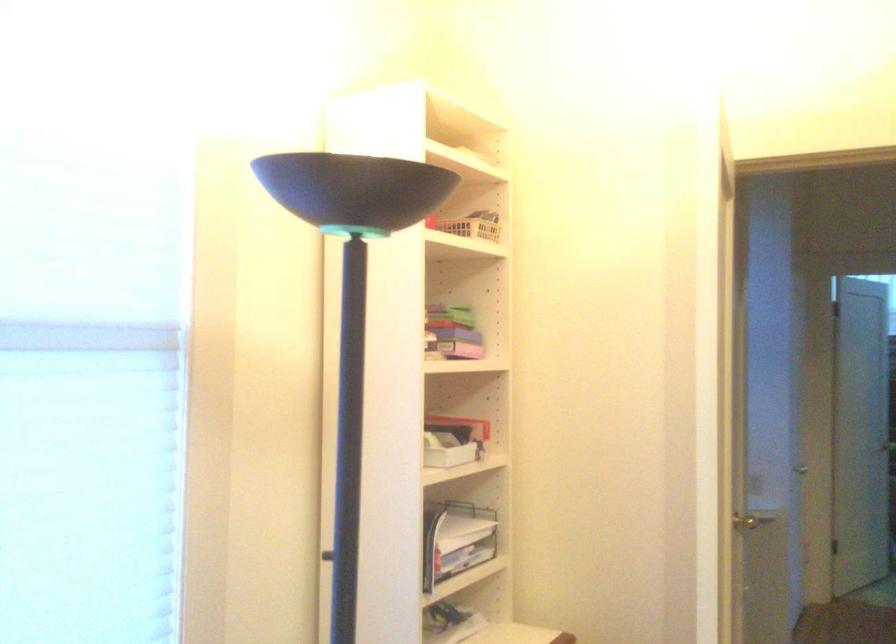
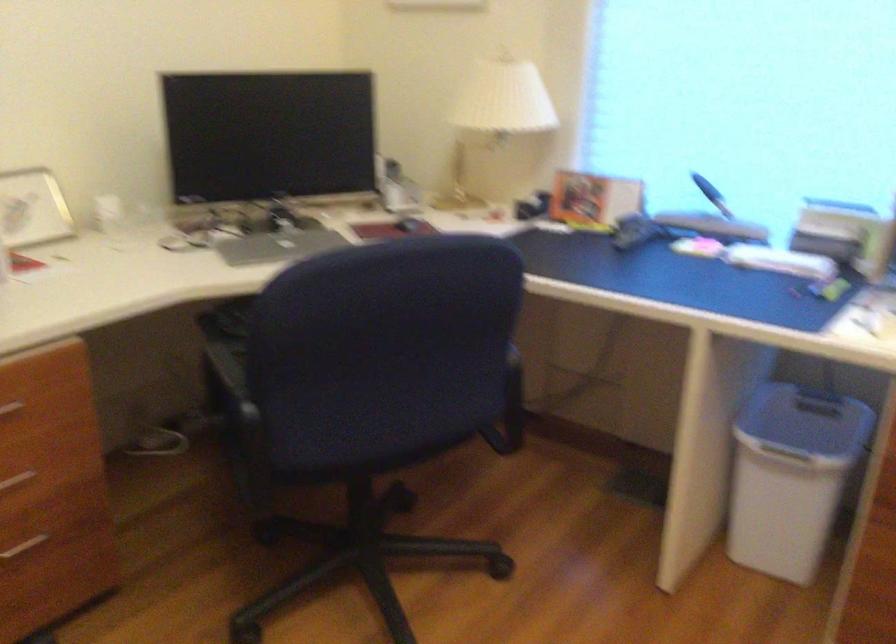
How did the camera likely rotate?

The rotation direction of the camera is left-down.